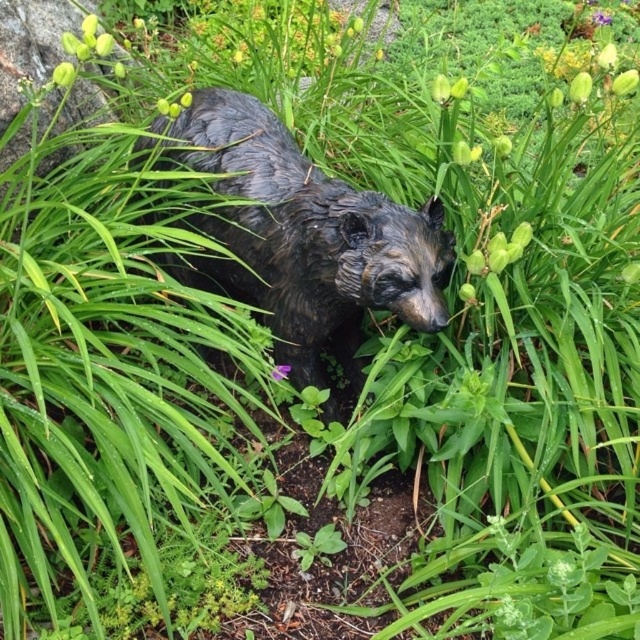
Question: In this image, where is bronze statue of bear at center located relative to purple matte flower at center?

Choices:
 (A) above
 (B) below

Answer: (A)

Question: Which of the following is the farthest from the observer?

Choices:
 (A) purple matte flower at center
 (B) bronze statue of bear at center

Answer: (A)

Question: Is bronze statue of bear at center bigger than purple matte flower at center?

Choices:
 (A) yes
 (B) no

Answer: (A)

Question: Does bronze statue of bear at center lie in front of purple matte flower at center?

Choices:
 (A) no
 (B) yes

Answer: (B)